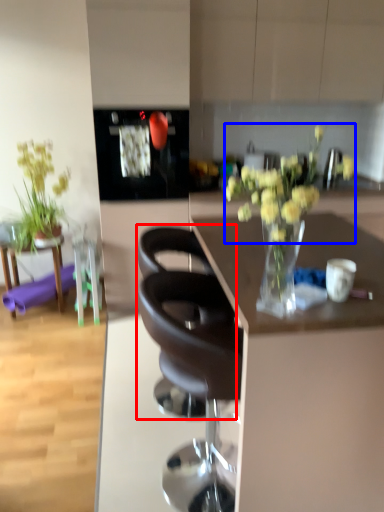
Question: Which of the following is the closest to the observer, chair (highlighted by a red box) or flower (highlighted by a blue box)?

Choices:
 (A) chair
 (B) flower

Answer: (B)